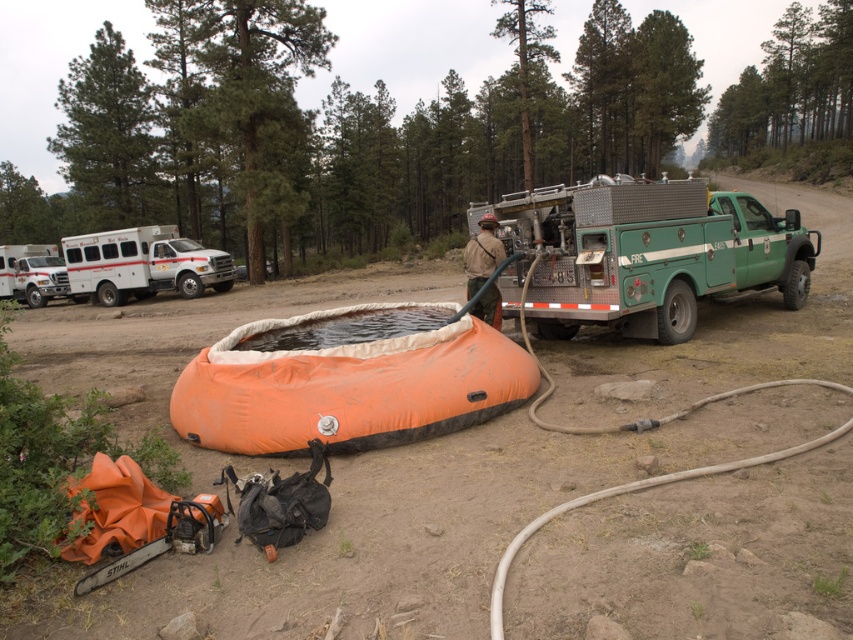
Question: Which of the following is the farthest from the observer?

Choices:
 (A) green metallic utility truck at center-right
 (B) white matte ambulance at left

Answer: (B)

Question: Estimate the real-world distances between objects in this image. Which object is farther from the black rubber tire at right?

Choices:
 (A) white matte ambulance at left
 (B) rubber/soft hose at right
 (C) white glossy ambulance at left
 (D) green textured trees at upper center

Answer: (D)

Question: Is white glossy ambulance at left wider than black rubber tire at right?

Choices:
 (A) yes
 (B) no

Answer: (A)

Question: Which object is the farthest from the rubber/soft hose at right?

Choices:
 (A) green metallic utility truck at center-right
 (B) brown canvas backpack at center
 (C) white glossy ambulance at left
 (D) black rubber tire at right

Answer: (C)

Question: Is white matte ambulance at left thinner than black rubber tire at right?

Choices:
 (A) yes
 (B) no

Answer: (B)

Question: Is green textured trees at upper center smaller than black rubber tire at right?

Choices:
 (A) no
 (B) yes

Answer: (A)